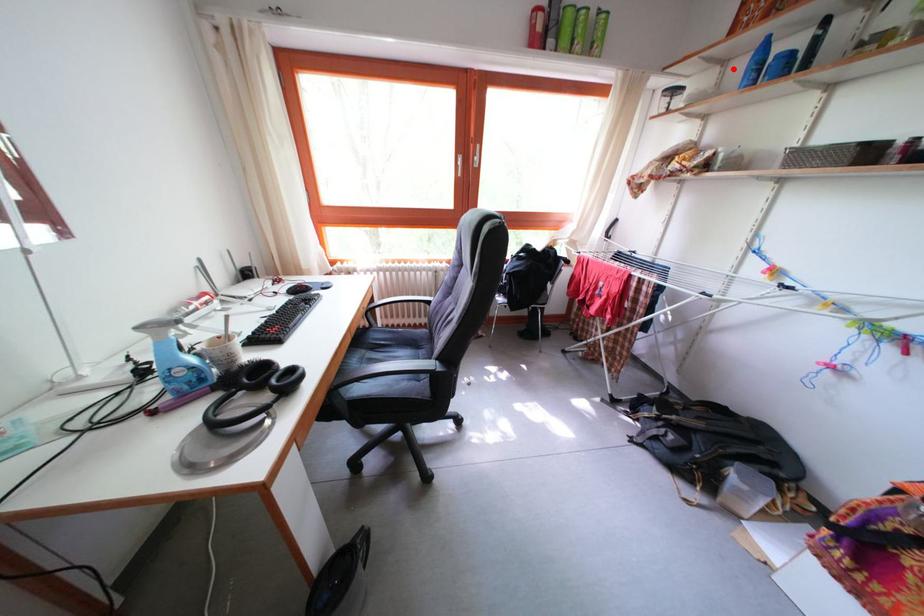
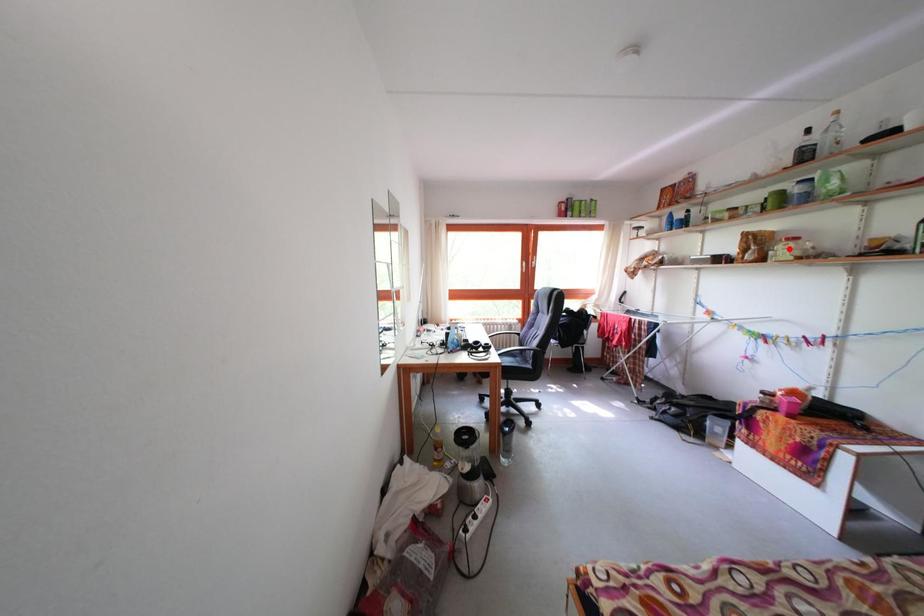
I am providing you with two images of the same scene from different viewpoints. A red point is marked on the first image and another point is marked on the second image. Is the marked point in image1 the same physical position as the marked point in image2?

No